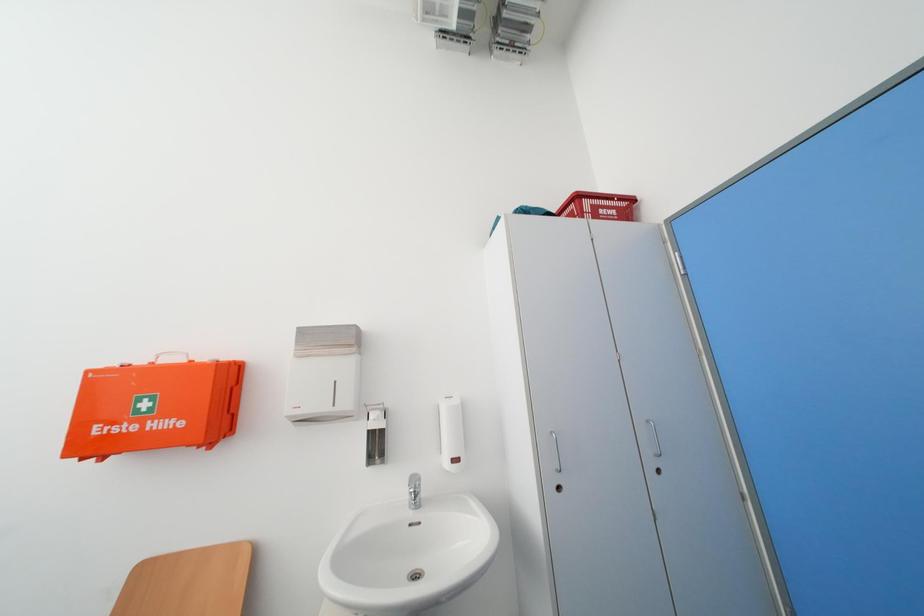
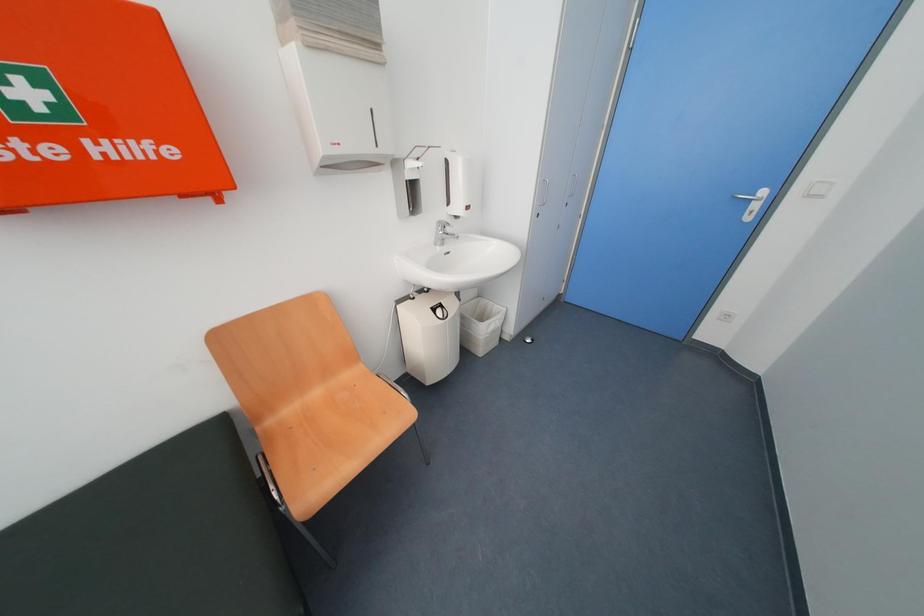
Based on the continuous images, in which direction is the camera rotating?

The rotation direction of the camera is right-down.